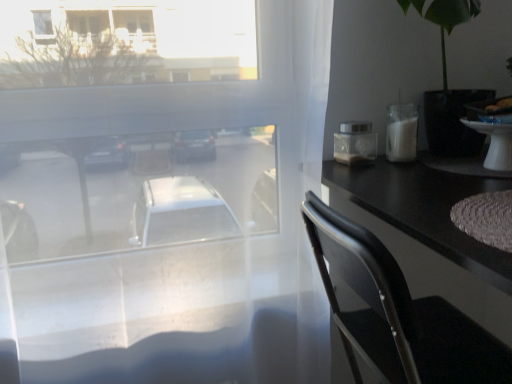
Question: Considering the positions of white glossy table at right and black plastic chair at right in the image, is white glossy table at right wider or thinner than black plastic chair at right?

Choices:
 (A) wide
 (B) thin

Answer: (B)

Question: Considering the relative positions of white glossy table at right and black plastic chair at right in the image provided, is white glossy table at right to the left or to the right of black plastic chair at right?

Choices:
 (A) left
 (B) right

Answer: (B)

Question: Which object is positioned closest to the transparent glass window at center?

Choices:
 (A) black plastic chair at right
 (B) white glossy table at right

Answer: (A)

Question: Estimate the real-world distances between objects in this image. Which object is farther from the black plastic chair at right?

Choices:
 (A) white glossy table at right
 (B) transparent glass window at center

Answer: (A)